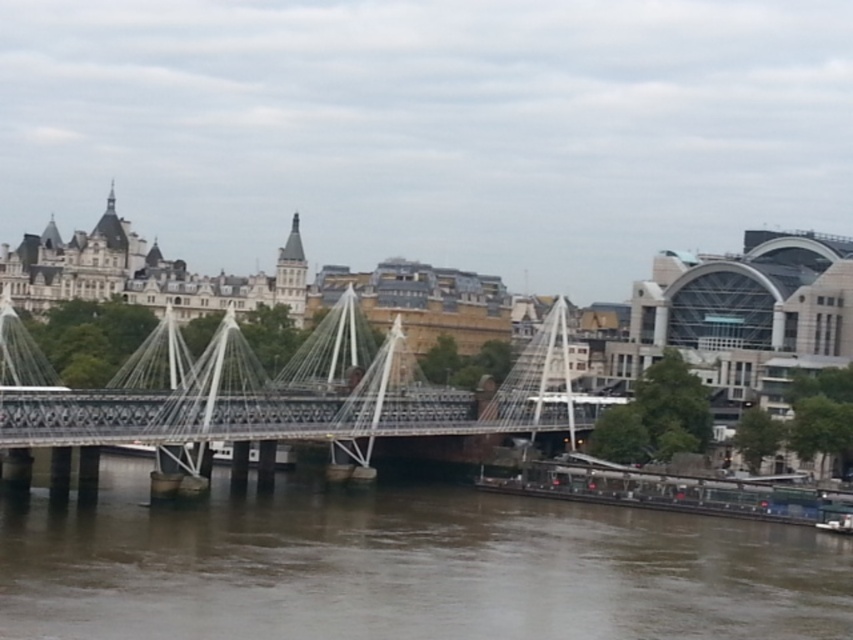
Does brown murky water at center have a smaller size compared to metallic silver suspension bridge at center?

Yes.

Is brown murky water at center above metallic silver suspension bridge at center?

Incorrect, brown murky water at center is not positioned above metallic silver suspension bridge at center.

Identify the location of brown murky water at center. (403, 566).

Identify the location of brown murky water at center. Image resolution: width=853 pixels, height=640 pixels. (403, 566).